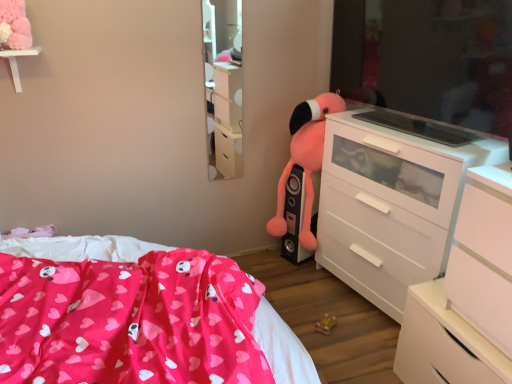
Question: Is light wood mirror at upper center closer to camera compared to white glossy chest of drawers at lower right, which is the 2th chest of drawers from back to front?

Choices:
 (A) yes
 (B) no

Answer: (B)

Question: From the image's perspective, would you say light wood mirror at upper center is shown under white glossy chest of drawers at lower right, which is the 2th chest of drawers from back to front?

Choices:
 (A) no
 (B) yes

Answer: (A)

Question: Can we say light wood mirror at upper center lies outside white glossy chest of drawers at lower right, which is the 2th chest of drawers from back to front?

Choices:
 (A) no
 (B) yes

Answer: (B)

Question: Does light wood mirror at upper center have a larger size compared to white glossy chest of drawers at lower right, acting as the 2th chest of drawers starting from the front?

Choices:
 (A) yes
 (B) no

Answer: (B)

Question: Is white glossy chest of drawers at lower right, acting as the 2th chest of drawers starting from the front, located within light wood mirror at upper center?

Choices:
 (A) no
 (B) yes

Answer: (A)

Question: Is light wood mirror at upper center smaller than white glossy chest of drawers at lower right, which is the 2th chest of drawers from back to front?

Choices:
 (A) yes
 (B) no

Answer: (A)

Question: Is white matte chest of drawers at right, the first chest of drawers viewed from the front, looking in the opposite direction of fluffy pink stuffed animal at center-right?

Choices:
 (A) no
 (B) yes

Answer: (A)

Question: Is the position of white matte chest of drawers at right, the first chest of drawers viewed from the front, more distant than that of fluffy pink stuffed animal at center-right?

Choices:
 (A) yes
 (B) no

Answer: (B)

Question: Is the depth of white matte chest of drawers at right, the 3th chest of drawers in the back-to-front sequence, less than that of fluffy pink stuffed animal at center-right?

Choices:
 (A) yes
 (B) no

Answer: (A)

Question: Is white matte chest of drawers at right, the first chest of drawers viewed from the front, smaller than fluffy pink stuffed animal at center-right?

Choices:
 (A) yes
 (B) no

Answer: (A)

Question: Can we say white matte chest of drawers at right, the first chest of drawers viewed from the front, lies outside fluffy pink stuffed animal at center-right?

Choices:
 (A) yes
 (B) no

Answer: (A)

Question: Is white matte chest of drawers at right, the first chest of drawers viewed from the front, not close to fluffy pink stuffed animal at center-right?

Choices:
 (A) yes
 (B) no

Answer: (A)

Question: Is fluffy pink stuffed animal at center-right placed right next to light wood mirror at upper center?

Choices:
 (A) no
 (B) yes

Answer: (A)